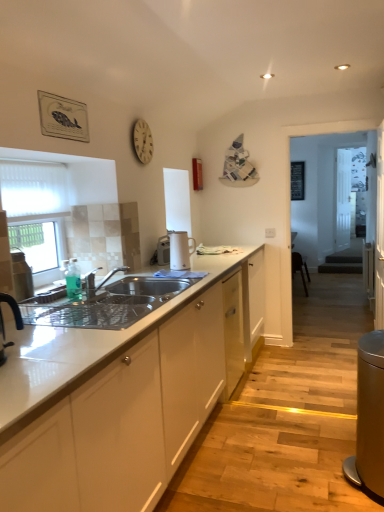
This screenshot has height=512, width=384. Describe the element at coordinates (142, 141) in the screenshot. I see `wooden clock at upper center` at that location.

What are the coordinates of `white glossy electric kettle at center, positioned as the 2th appliance in bottom-to-top order` in the screenshot? It's located at (180, 250).

Describe the element at coordinates (180, 250) in the screenshot. I see `white glossy electric kettle at center, which is the first appliance in top-to-bottom order` at that location.

Measure the distance between point (306, 291) and camera.

A distance of 20.67 feet exists between point (306, 291) and camera.

At what (x,y) coordinates should I click in order to perform the action: click on transparent glass door at center, which appears as the first glass door when viewed from the front. Please return your answer as a coordinate pair (x, y). This screenshot has width=384, height=512. Looking at the image, I should click on [348, 192].

Image resolution: width=384 pixels, height=512 pixels. Describe the element at coordinates (348, 192) in the screenshot. I see `transparent glass door at center, which appears as the first glass door when viewed from the front` at that location.

The width and height of the screenshot is (384, 512). What do you see at coordinates (33, 188) in the screenshot?
I see `white mesh screen at left` at bounding box center [33, 188].

The height and width of the screenshot is (512, 384). Identify the location of wooden clock at upper center. (142, 141).

From a real-world perspective, is transparent glass door at center, which appears as the first glass door when viewed from the front, beneath white mesh screen at left?

Yes, from a real-world perspective, transparent glass door at center, which appears as the first glass door when viewed from the front, is under white mesh screen at left.

Can you confirm if transparent glass door at center, which is the 2th glass door from back to front, is wider than white mesh screen at left?

Indeed, transparent glass door at center, which is the 2th glass door from back to front, has a greater width compared to white mesh screen at left.

Is transparent glass door at center, which appears as the first glass door when viewed from the front, placed right next to white mesh screen at left?

No, transparent glass door at center, which appears as the first glass door when viewed from the front, is not making contact with white mesh screen at left.

Does transparent glass door at center, which appears as the first glass door when viewed from the front, lie behind white mesh screen at left?

Yes, the depth of transparent glass door at center, which appears as the first glass door when viewed from the front, is greater than that of white mesh screen at left.

How much distance is there between black plastic bar stool at right and wooden clock at upper center?

black plastic bar stool at right and wooden clock at upper center are 4.06 meters apart from each other.

Can you tell me how much black plastic bar stool at right and wooden clock at upper center differ in facing direction?

The facing directions of black plastic bar stool at right and wooden clock at upper center are 3.03 degrees apart.

Which of these two, black plastic bar stool at right or wooden clock at upper center, is wider?

Wider between the two is black plastic bar stool at right.

Where is `clock above the black plastic bar stool at right (from the image's perspective)`? clock above the black plastic bar stool at right (from the image's perspective) is located at coordinates (142, 141).

From the image's perspective, is satin silver sink at center located beneath wooden clock at upper center?

Yes.

Considering the relative sizes of satin silver sink at center and wooden clock at upper center in the image provided, is satin silver sink at center taller than wooden clock at upper center?

In fact, satin silver sink at center may be shorter than wooden clock at upper center.

Is satin silver sink at center oriented away from wooden clock at upper center?

No, wooden clock at upper center is not at the back of satin silver sink at center.

Does point (184, 280) lie behind point (139, 131)?

No, it is in front of (139, 131).

Is clear glass door at center, which is the first glass door in back-to-front order, located within metallic trash can at right, the 1th appliance from the front?

Actually, clear glass door at center, which is the first glass door in back-to-front order, is outside metallic trash can at right, the 1th appliance from the front.

From the image's perspective, which object appears higher, metallic trash can at right, the first appliance when ordered from bottom to top, or clear glass door at center, which is the 2th glass door from front to back?

clear glass door at center, which is the 2th glass door from front to back, is shown above in the image.

Is metallic trash can at right, the 2th appliance in the top-to-bottom sequence, positioned far away from clear glass door at center, which is the first glass door in back-to-front order?

Absolutely, metallic trash can at right, the 2th appliance in the top-to-bottom sequence, is distant from clear glass door at center, which is the first glass door in back-to-front order.

Would you say transparent glass door at center, which appears as the first glass door when viewed from the front, is inside or outside metallic trash can at right, the 2th appliance in the top-to-bottom sequence?

transparent glass door at center, which appears as the first glass door when viewed from the front, is spatially situated outside metallic trash can at right, the 2th appliance in the top-to-bottom sequence.

Is transparent glass door at center, which appears as the first glass door when viewed from the front, to the right of metallic trash can at right, arranged as the second appliance when viewed from the left, from the viewer's perspective?

Indeed, transparent glass door at center, which appears as the first glass door when viewed from the front, is positioned on the right side of metallic trash can at right, arranged as the second appliance when viewed from the left.

Considering the sizes of objects transparent glass door at center, which is the 2th glass door from back to front, and metallic trash can at right, arranged as the second appliance when viewed from the left, in the image provided, who is wider, transparent glass door at center, which is the 2th glass door from back to front, or metallic trash can at right, arranged as the second appliance when viewed from the left,?

Wider between the two is metallic trash can at right, arranged as the second appliance when viewed from the left.

Which object is closer to the camera, white mesh screen at left or white glossy electric kettle at center, the 2th appliance when ordered from right to left?

white mesh screen at left is closer to the camera.

Considering the points (53, 193) and (183, 249), which point is in front, point (53, 193) or point (183, 249)?

The point (53, 193) is more forward.

In the scene shown: From the image's perspective, relative to white glossy electric kettle at center, the 2th appliance when ordered from right to left, is white mesh screen at left above or below?

white mesh screen at left is above white glossy electric kettle at center, the 2th appliance when ordered from right to left.

Is wooden clock at upper center thinner than black rubber tap at left?

Yes.

From the image's perspective, which one is positioned lower, wooden clock at upper center or black rubber tap at left?

black rubber tap at left is shown below in the image.

Is wooden clock at upper center smaller than black rubber tap at left?

Yes.

You are a GUI agent. You are given a task and a screenshot of the screen. Output one action in this format:
    pyautogui.click(x=<x>, y=<y>)
    Task: Click on the tap below the wooden clock at upper center (from the image's perspective)
    
    Given the screenshot: What is the action you would take?
    pyautogui.click(x=13, y=309)

Identify the location of the 1st glass door to the right of the white mesh screen at left, counting from the anchor's position. The image size is (384, 512). (348, 192).

The height and width of the screenshot is (512, 384). Find the location of `bar stool below the wooden clock at upper center (from the image's perspective)`. bar stool below the wooden clock at upper center (from the image's perspective) is located at coordinates (300, 269).

Estimate the real-world distances between objects in this image. Which object is closer to white mesh screen at left, black rubber tap at left or white glossy electric kettle at center, which is the 1th appliance from left to right?

white glossy electric kettle at center, which is the 1th appliance from left to right, is positioned closer to the anchor white mesh screen at left.

From the image, which object appears to be farther from white glossy electric kettle at center, which is the first appliance from back to front, white mesh screen at left or clear glass door at center, which is the first glass door in back-to-front order?

clear glass door at center, which is the first glass door in back-to-front order, is positioned further to the anchor white glossy electric kettle at center, which is the first appliance from back to front.

Based on their spatial positions, is wooden clock at upper center or metallic trash can at right, the first appliance when ordered from bottom to top, closer to black plastic bar stool at right?

wooden clock at upper center is closer to black plastic bar stool at right.

Based on their spatial positions, is black rubber tap at left or metallic trash can at right, arranged as the second appliance when viewed from the left, closer to wooden clock at upper center?

black rubber tap at left is positioned closer to the anchor wooden clock at upper center.

From the image, which object appears to be farther from black rubber tap at left, clear glass door at center, which is the 2th glass door from front to back, or metallic trash can at right, the first appliance when ordered from bottom to top?

The object further to black rubber tap at left is clear glass door at center, which is the 2th glass door from front to back.

From the image, which object appears to be farther from metallic trash can at right, arranged as the second appliance when viewed from the left, white mesh screen at left or white glossy electric kettle at center, which is the first appliance from back to front?

white mesh screen at left lies further to metallic trash can at right, arranged as the second appliance when viewed from the left, than the other object.

From the image, which object appears to be nearer to clear glass door at center, which is the first glass door in back-to-front order, transparent glass door at center, which is the 2th glass door from back to front, or black rubber tap at left?

transparent glass door at center, which is the 2th glass door from back to front, lies closer to clear glass door at center, which is the first glass door in back-to-front order, than the other object.

From the image, which object appears to be farther from satin silver sink at center, white mesh screen at left or black plastic bar stool at right?

The object further to satin silver sink at center is black plastic bar stool at right.

Where is `sink positioned between black rubber tap at left and black plastic bar stool at right from near to far`? The image size is (384, 512). sink positioned between black rubber tap at left and black plastic bar stool at right from near to far is located at coordinates (107, 304).

Where is `glass door between black rubber tap at left and clear glass door at center, which is the first glass door in back-to-front order, along the z-axis`? This screenshot has width=384, height=512. glass door between black rubber tap at left and clear glass door at center, which is the first glass door in back-to-front order, along the z-axis is located at coordinates (348, 192).

Find the location of a particular element. The width and height of the screenshot is (384, 512). appliance between white mesh screen at left and metallic trash can at right, the 1th appliance from the front is located at coordinates (180, 250).

Identify the location of clock located between satin silver sink at center and clear glass door at center, which is the first glass door in back-to-front order, in the depth direction. (142, 141).